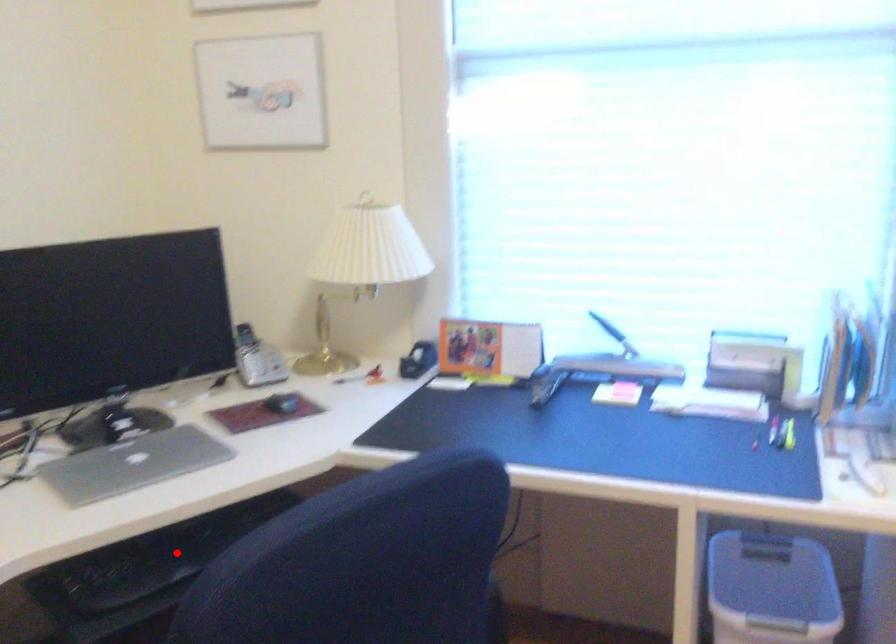
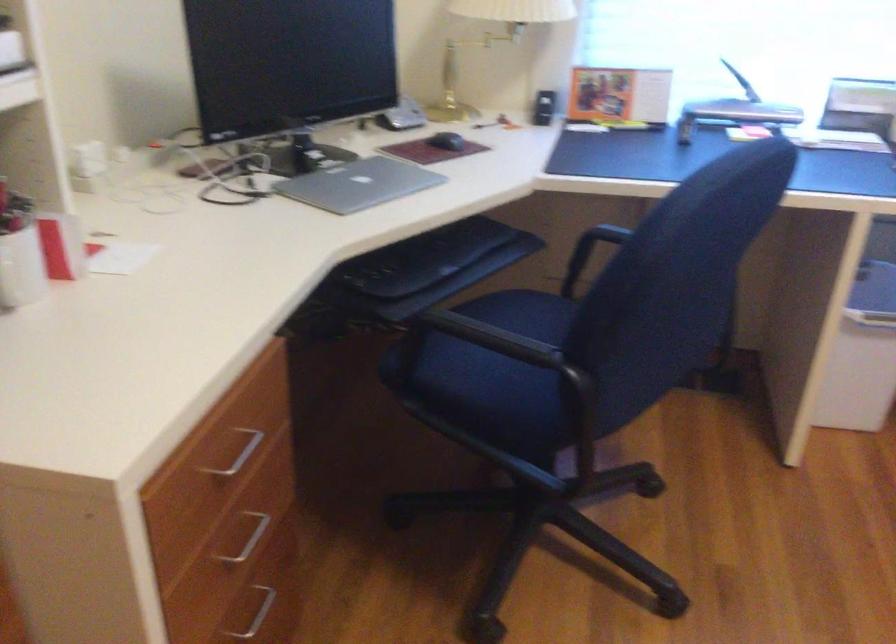
Where in the second image is the point corresponding to the highlighted location from the first image?

(425, 258)